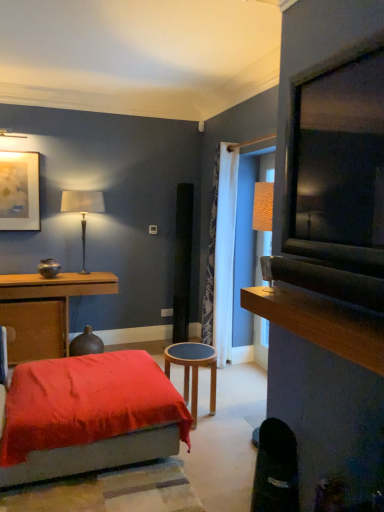
Question: Can you confirm if wooden stool at center, which is counted as the first table, starting from the front, is smaller than metallic gold table lamp at upper left?

Choices:
 (A) yes
 (B) no

Answer: (A)

Question: Is wooden stool at center, positioned as the 1th table in right-to-left order, in contact with metallic gold table lamp at upper left?

Choices:
 (A) yes
 (B) no

Answer: (B)

Question: Can you confirm if wooden stool at center, arranged as the 2th table when viewed from the back, is thinner than metallic gold table lamp at upper left?

Choices:
 (A) yes
 (B) no

Answer: (B)

Question: Does wooden stool at center, which is counted as the first table, starting from the front, have a larger size compared to metallic gold table lamp at upper left?

Choices:
 (A) yes
 (B) no

Answer: (B)

Question: From a real-world perspective, is wooden stool at center, which is the second table from left to right, physically above metallic gold table lamp at upper left?

Choices:
 (A) no
 (B) yes

Answer: (A)

Question: Is wooden stool at center, which is the second table from left to right, looking in the opposite direction of metallic gold table lamp at upper left?

Choices:
 (A) yes
 (B) no

Answer: (B)

Question: Considering the relative sizes of matte gold picture frame at upper left and metallic gold table lamp at upper left in the image provided, is matte gold picture frame at upper left bigger than metallic gold table lamp at upper left?

Choices:
 (A) no
 (B) yes

Answer: (A)

Question: From the image's perspective, is matte gold picture frame at upper left above metallic gold table lamp at upper left?

Choices:
 (A) no
 (B) yes

Answer: (B)

Question: Is metallic gold table lamp at upper left at the back of matte gold picture frame at upper left?

Choices:
 (A) no
 (B) yes

Answer: (A)

Question: Is matte gold picture frame at upper left to the right of metallic gold table lamp at upper left from the viewer's perspective?

Choices:
 (A) no
 (B) yes

Answer: (A)

Question: Is matte gold picture frame at upper left behind metallic gold table lamp at upper left?

Choices:
 (A) yes
 (B) no

Answer: (B)

Question: Is matte gold picture frame at upper left at the left side of metallic gold table lamp at upper left?

Choices:
 (A) no
 (B) yes

Answer: (B)

Question: Is the depth of white textured curtain at center greater than that of metallic gold table lamp at upper left?

Choices:
 (A) no
 (B) yes

Answer: (A)